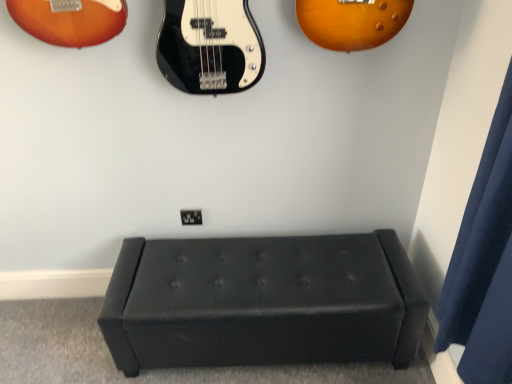
Question: In terms of size, does black leather ottoman at center appear bigger or smaller than dark blue fabric curtain at right?

Choices:
 (A) small
 (B) big

Answer: (B)

Question: From a real-world perspective, is black leather ottoman at center physically located above or below dark blue fabric curtain at right?

Choices:
 (A) below
 (B) above

Answer: (A)

Question: In the image, is black leather ottoman at center positioned in front of or behind dark blue fabric curtain at right?

Choices:
 (A) behind
 (B) front

Answer: (A)

Question: Considering the positions of dark blue fabric curtain at right and black leather ottoman at center in the image, is dark blue fabric curtain at right bigger or smaller than black leather ottoman at center?

Choices:
 (A) big
 (B) small

Answer: (B)

Question: Is point (459, 274) closer or farther from the camera than point (223, 352)?

Choices:
 (A) closer
 (B) farther

Answer: (A)

Question: In the image, is dark blue fabric curtain at right positioned in front of or behind black leather ottoman at center?

Choices:
 (A) front
 (B) behind

Answer: (A)

Question: In the image, is dark blue fabric curtain at right on the left side or the right side of black leather ottoman at center?

Choices:
 (A) right
 (B) left

Answer: (A)